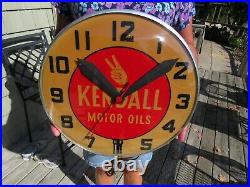
Where is `pale orange circle around red circle on clock face`? This screenshot has height=187, width=250. pale orange circle around red circle on clock face is located at coordinates (181, 88).